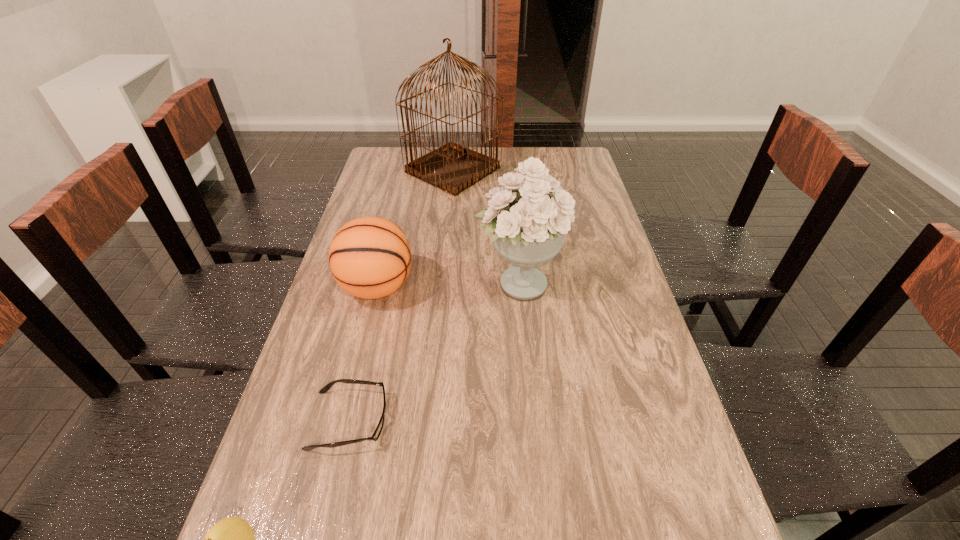
Where is `free space between the fourth farthest object and the farthest object`? free space between the fourth farthest object and the farthest object is located at coordinates (401, 295).

I want to click on vacant area that lies between the second tallest object and the third tallest object, so click(x=448, y=285).

At what (x,y) coordinates should I click in order to perform the action: click on free space that is in between the third shortest object and the second tallest object. Please return your answer as a coordinate pair (x, y). Looking at the image, I should click on (448, 285).

I want to click on object that can be found as the fourth closest to the nearest object, so click(x=453, y=168).

Choose which object is the third nearest neighbor to the shortest object. Please provide its 2D coordinates. Your answer should be formatted as a tuple, i.e. [(x, y)], where the tuple contains the x and y coordinates of a point satisfying the conditions above.

[(528, 217)]

Identify the location of vacant space that satisfies the following two spatial constraints: 1. on the back side of the second tallest object; 2. on the left side of the third shortest object. The image size is (960, 540). (378, 283).

This screenshot has width=960, height=540. I want to click on vacant space that satisfies the following two spatial constraints: 1. on the front side of the tallest object; 2. on the left side of the bouquet, so click(x=443, y=283).

Identify the location of free space in the image that satisfies the following two spatial constraints: 1. on the front side of the bouquet; 2. on the front-facing side of the shortest object. The width and height of the screenshot is (960, 540). (532, 421).